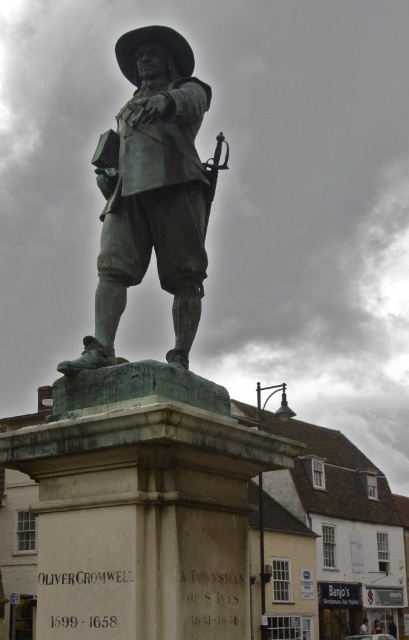
Question: Among these points, which one is nearest to the camera?

Choices:
 (A) click(x=200, y=282)
 (B) click(x=226, y=140)

Answer: (A)

Question: Is the position of bronze statue at center less distant than that of polished bronze rifle at upper center?

Choices:
 (A) yes
 (B) no

Answer: (A)

Question: Among these points, which one is farthest from the camera?

Choices:
 (A) (164, 209)
 (B) (209, 164)

Answer: (B)

Question: Which point is farther from the camera taking this photo?

Choices:
 (A) (224, 141)
 (B) (179, 92)

Answer: (A)

Question: Considering the relative positions of bronze statue at center and polished bronze rifle at upper center in the image provided, where is bronze statue at center located with respect to polished bronze rifle at upper center?

Choices:
 (A) below
 (B) above

Answer: (B)

Question: Does bronze statue at center have a greater width compared to polished bronze rifle at upper center?

Choices:
 (A) no
 (B) yes

Answer: (B)